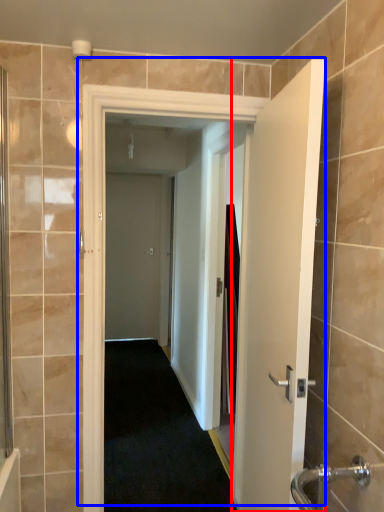
Question: Which of the following is the closest to the observer, door (highlighted by a red box) or door (highlighted by a blue box)?

Choices:
 (A) door
 (B) door

Answer: (A)